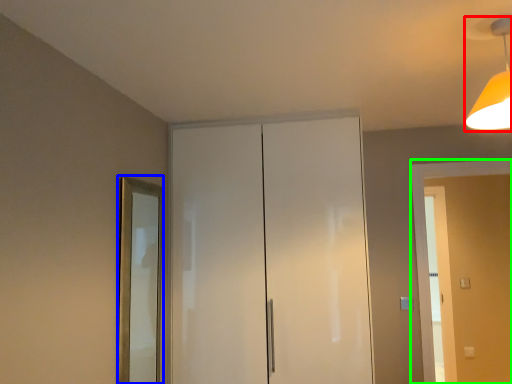
Question: Considering the real-world distances, which object is closest to light fixture (highlighted by a red box)? mirror (highlighted by a blue box) or screen door (highlighted by a green box).

Choices:
 (A) mirror
 (B) screen door

Answer: (B)